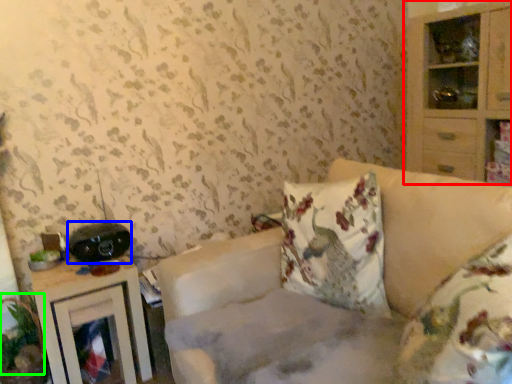
Question: Which is nearer to the cabinetry (highlighted by a red box)? stereo (highlighted by a blue box) or plant (highlighted by a green box).

Choices:
 (A) stereo
 (B) plant

Answer: (A)